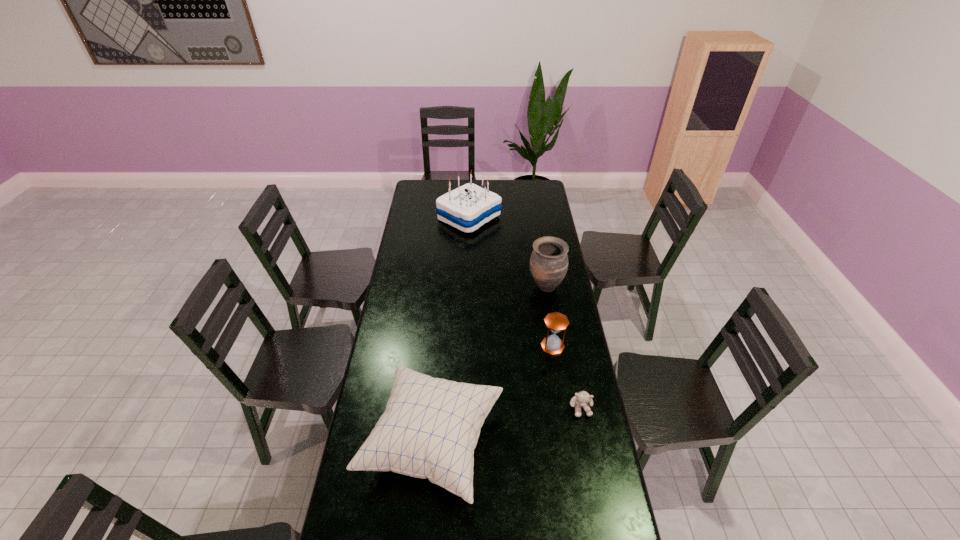
This screenshot has height=540, width=960. In order to click on free space located on the face of the shortest object in this screenshot , I will do coord(605,532).

This screenshot has width=960, height=540. I want to click on object at the far edge, so click(468, 207).

Where is `object that is positioned at the left edge`? This screenshot has width=960, height=540. object that is positioned at the left edge is located at coordinates (430, 427).

At what (x,y) coordinates should I click in order to perform the action: click on urn situated at the right edge. Please return your answer as a coordinate pair (x, y). Image resolution: width=960 pixels, height=540 pixels. Looking at the image, I should click on (549, 260).

This screenshot has height=540, width=960. Identify the location of hourglass positioned at the right edge. (556, 322).

You are a GUI agent. You are given a task and a screenshot of the screen. Output one action in this format:
    pyautogui.click(x=<x>, y=<y>)
    Task: Click on the teddy bear that is positioned at the right edge
    The width and height of the screenshot is (960, 540).
    Given the screenshot: What is the action you would take?
    pyautogui.click(x=581, y=399)

Locate an element on the screen. The height and width of the screenshot is (540, 960). free location at the left edge is located at coordinates (397, 292).

In the image, there is a desktop. At what (x,y) coordinates should I click in order to perform the action: click on free space at the right edge. Please return your answer as a coordinate pair (x, y). Image resolution: width=960 pixels, height=540 pixels. Looking at the image, I should click on (556, 230).

Where is `unoccupied position between the farthest object and the shortest object`? unoccupied position between the farthest object and the shortest object is located at coordinates (525, 312).

Identify the location of free space between the second farthest object and the birthday cake. The height and width of the screenshot is (540, 960). (508, 252).